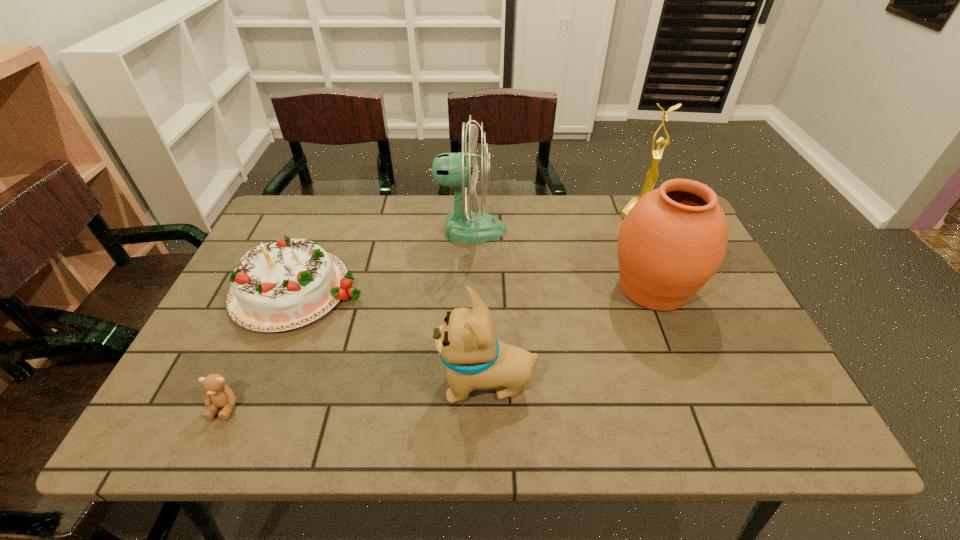
This screenshot has height=540, width=960. Find the location of `award`. award is located at coordinates (652, 175).

Locate an element on the screen. The image size is (960, 540). fan is located at coordinates (460, 170).

Find the location of a particular element. the fourth shortest object is located at coordinates (673, 240).

Locate an element on the screen. This screenshot has width=960, height=540. puppy is located at coordinates pyautogui.click(x=475, y=360).

Find the location of a particular element. This screenshot has width=960, height=540. cake is located at coordinates (281, 285).

Find the location of a particular element. This screenshot has height=540, width=960. teddy bear is located at coordinates (219, 395).

You are a GUI agent. You are given a task and a screenshot of the screen. Output one action in this format:
    pyautogui.click(x=<x>, y=<y>)
    Task: Click on the free space located 0.070m on the front-facing side of the award
    This screenshot has height=540, width=960.
    Given the screenshot: What is the action you would take?
    pyautogui.click(x=651, y=239)

At what (x,y) coordinates should I click in order to perform the action: click on free space located in front of the fan, directing airflow. Please return your answer as a coordinate pair (x, y). Image resolution: width=960 pixels, height=540 pixels. Looking at the image, I should click on (542, 230).

Image resolution: width=960 pixels, height=540 pixels. I want to click on vacant area situated 0.200m on the left of the third tallest object, so click(x=532, y=287).

You are a GUI agent. You are given a task and a screenshot of the screen. Output one action in this format:
    pyautogui.click(x=<x>, y=<y>)
    Task: Click on the vacant point located 0.300m on the face of the third shortest object
    
    Given the screenshot: What is the action you would take?
    pyautogui.click(x=300, y=383)